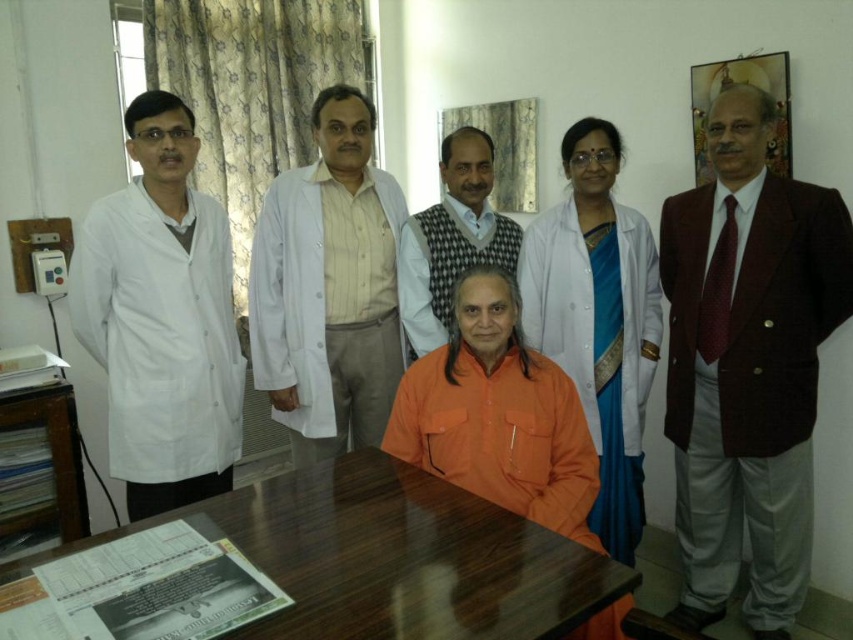
Which of these two, maroon fabric suit at right or orange cotton shirt at center, stands shorter?

orange cotton shirt at center

Based on the photo, who is positioned more to the left, maroon fabric suit at right or orange cotton shirt at center?

From the viewer's perspective, orange cotton shirt at center appears more on the left side.

Describe the element at coordinates (747, 364) in the screenshot. I see `maroon fabric suit at right` at that location.

Identify the location of maroon fabric suit at right. This screenshot has height=640, width=853. (747, 364).

Who is taller, maroon fabric suit at right or white matte lab coat at left?

maroon fabric suit at right

The height and width of the screenshot is (640, 853). Describe the element at coordinates (747, 364) in the screenshot. I see `maroon fabric suit at right` at that location.

Between point (744, 92) and point (167, 362), which one is positioned behind?

Positioned behind is point (744, 92).

Where is `maroon fabric suit at right`? The width and height of the screenshot is (853, 640). maroon fabric suit at right is located at coordinates (747, 364).

Is white matte lab coat at center thinner than orange cotton shirt at center?

Correct, white matte lab coat at center's width is less than orange cotton shirt at center's.

How distant is white matte lab coat at center from orange cotton shirt at center?

25.25 inches

I want to click on white matte lab coat at center, so click(x=328, y=285).